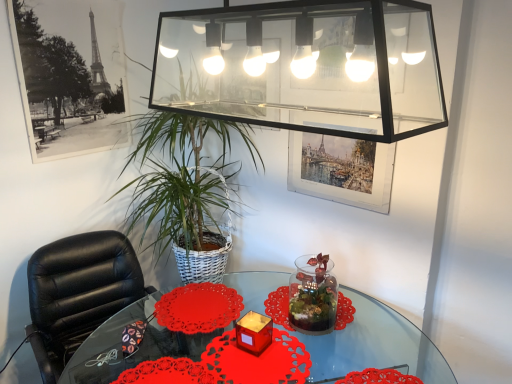
Question: Is transparent glass table at center inside or outside of black paper picture frame at upper left, acting as the second picture frame starting from the right?

Choices:
 (A) inside
 (B) outside

Answer: (B)

Question: Is transparent glass table at center to the left or to the right of black paper picture frame at upper left, placed as the 1th picture frame when sorted from left to right, in the image?

Choices:
 (A) right
 (B) left

Answer: (A)

Question: Estimate the real-world distances between objects in this image. Which object is farther from the black leather chair at left?

Choices:
 (A) clear glass light fixture at upper center
 (B) black paper picture frame at upper left, placed as the 1th picture frame when sorted from left to right
 (C) watercolor paper picture frame at upper center, which is counted as the second picture frame, starting from the left
 (D) transparent glass table at center
 (E) transparent glass vase at center

Answer: (A)

Question: Estimate the real-world distances between objects in this image. Which object is farther from the translucent glass candle at center?

Choices:
 (A) transparent glass vase at center
 (B) transparent glass table at center
 (C) black paper picture frame at upper left, placed as the 1th picture frame when sorted from left to right
 (D) watercolor paper picture frame at upper center, which is counted as the second picture frame, starting from the left
 (E) black leather chair at left

Answer: (C)